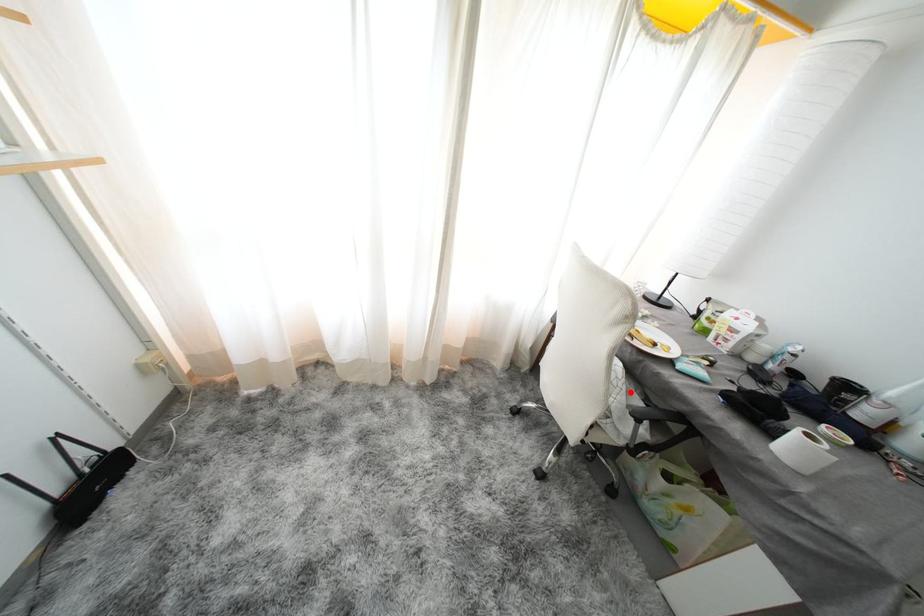
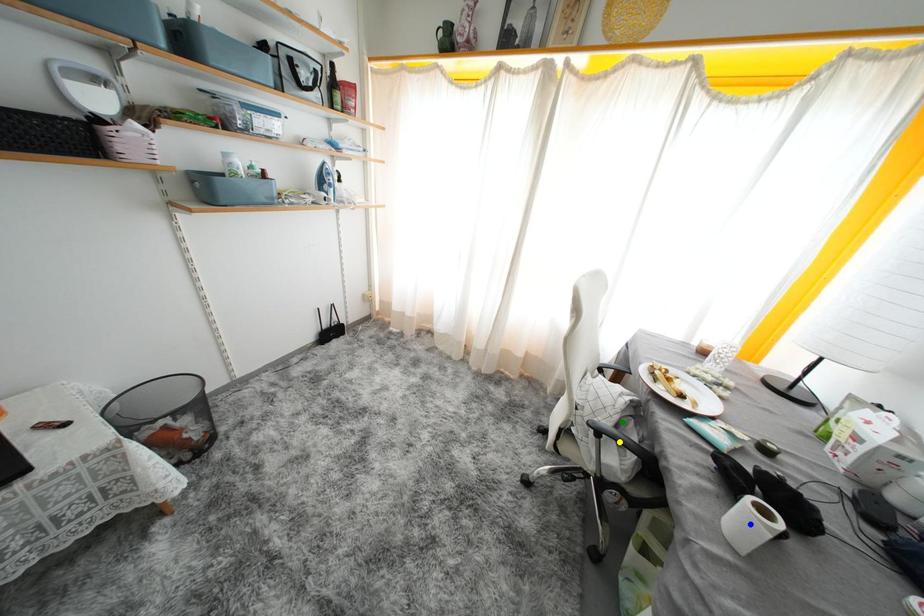
Question: I am providing you with two images of the same scene from different viewpoints. A red point is marked on the first image. You are given multiple points on the second image. Which mark in image 2 goes with the point in image 1?

Choices:
 (A) blue point
 (B) green point
 (C) yellow point

Answer: (B)